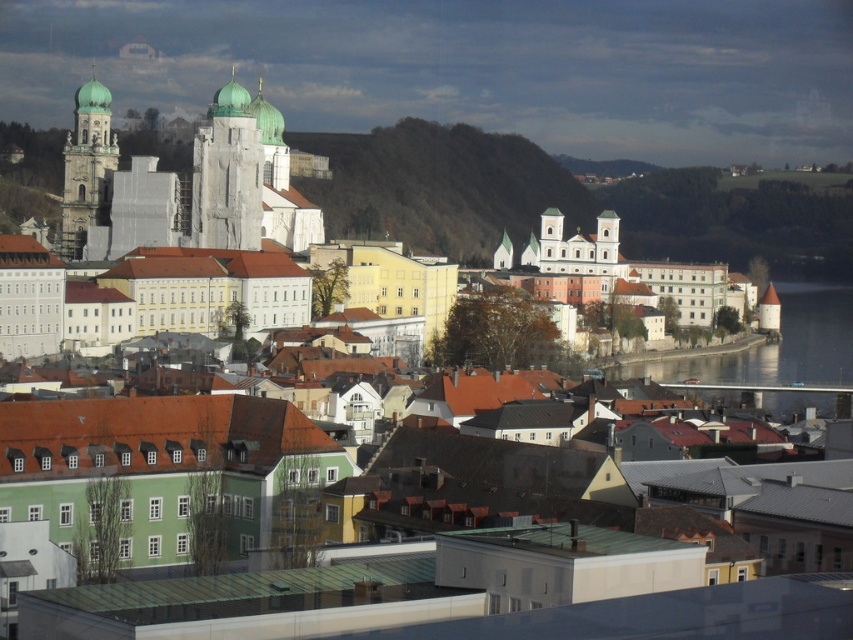
Question: Which object appears closest to the camera in this image?

Choices:
 (A) white stone tower at center
 (B) bare earth hillside at center
 (C) transparent glass water at river right
 (D) matte white tower at left

Answer: (C)

Question: Can you confirm if white stone tower at center is wider than matte white tower at left?

Choices:
 (A) no
 (B) yes

Answer: (B)

Question: Based on their relative distances, which object is nearer to the bare earth hillside at center?

Choices:
 (A) transparent glass water at river right
 (B) matte white tower at left
 (C) white stone tower at center

Answer: (A)

Question: Can you confirm if bare earth hillside at center is smaller than matte white tower at left?

Choices:
 (A) yes
 (B) no

Answer: (B)

Question: Which of these objects is positioned closest to the matte white tower at left?

Choices:
 (A) white stone tower at center
 (B) bare earth hillside at center
 (C) transparent glass water at river right

Answer: (A)

Question: From the image, what is the correct spatial relationship of transparent glass water at river right in relation to white stone tower at center?

Choices:
 (A) right
 (B) left

Answer: (A)